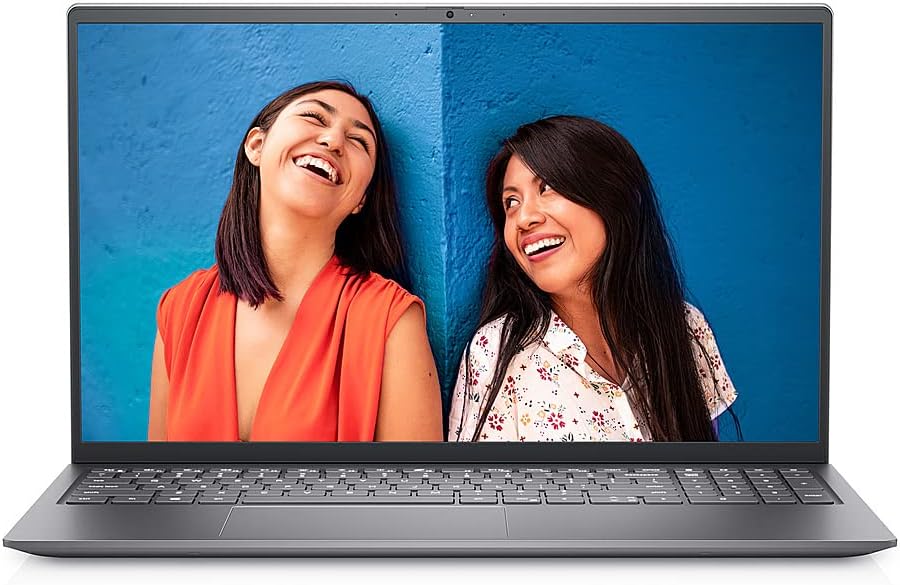
The image size is (900, 585). Find the location of `corner`. corner is located at coordinates (437, 216), (434, 106), (447, 313).